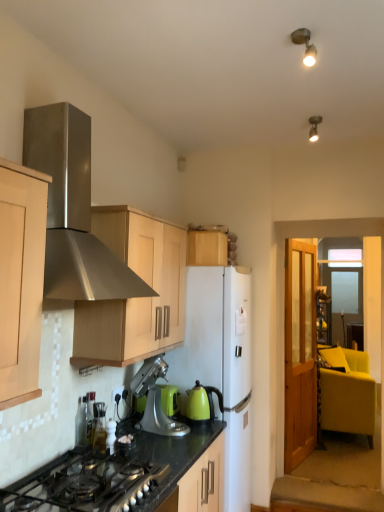
Question: Does metallic spot light at upper right, the 1th light fixture viewed from the left, turn towards black matte gas stove at lower left?

Choices:
 (A) yes
 (B) no

Answer: (B)

Question: Considering the relative sizes of metallic spot light at upper right, the 2th light fixture positioned from the right, and black matte gas stove at lower left in the image provided, is metallic spot light at upper right, the 2th light fixture positioned from the right, wider than black matte gas stove at lower left?

Choices:
 (A) no
 (B) yes

Answer: (A)

Question: Is metallic spot light at upper right, which is the first light fixture in front-to-back order, positioned with its back to black matte gas stove at lower left?

Choices:
 (A) yes
 (B) no

Answer: (B)

Question: From the image's perspective, does metallic spot light at upper right, the 1th light fixture viewed from the left, appear higher than black matte gas stove at lower left?

Choices:
 (A) no
 (B) yes

Answer: (B)

Question: Is metallic spot light at upper right, the 2th light fixture positioned from the right, further to camera compared to black matte gas stove at lower left?

Choices:
 (A) yes
 (B) no

Answer: (A)

Question: Considering their positions, is metallic spot light at upper right, which is the first light fixture in front-to-back order, located in front of or behind green matte kettle at center, the 1th kitchen appliance in the right-to-left sequence?

Choices:
 (A) behind
 (B) front

Answer: (B)

Question: Is metallic spot light at upper right, which is the first light fixture in front-to-back order, bigger or smaller than green matte kettle at center, the 1th kitchen appliance in the right-to-left sequence?

Choices:
 (A) big
 (B) small

Answer: (B)

Question: Is point (299, 36) positioned closer to the camera than point (205, 406)?

Choices:
 (A) farther
 (B) closer

Answer: (B)

Question: From the image's perspective, is metallic spot light at upper right, which is the first light fixture in front-to-back order, located above or below green matte kettle at center, the 1th kitchen appliance in the right-to-left sequence?

Choices:
 (A) below
 (B) above

Answer: (B)

Question: Would you say white matte refrigerator at center is to the left or to the right of green matte kettle at center, the 1th kitchen appliance in the right-to-left sequence, in the picture?

Choices:
 (A) right
 (B) left

Answer: (A)

Question: In terms of width, does white matte refrigerator at center look wider or thinner when compared to green matte kettle at center, the 1th kitchen appliance in the right-to-left sequence?

Choices:
 (A) thin
 (B) wide

Answer: (B)

Question: Does point (190, 359) appear closer or farther from the camera than point (192, 415)?

Choices:
 (A) farther
 (B) closer

Answer: (A)

Question: From the image's perspective, is white matte refrigerator at center positioned above or below green matte kettle at center, the 2th kitchen appliance positioned from the left?

Choices:
 (A) above
 (B) below

Answer: (B)

Question: Which is correct: black granite countertop at lower center is inside silver metallic stand mixer at center, marked as the 1th kitchen appliance in a left-to-right arrangement, or outside of it?

Choices:
 (A) outside
 (B) inside

Answer: (A)

Question: From the image's perspective, is black granite countertop at lower center located above or below silver metallic stand mixer at center, the second kitchen appliance in the right-to-left sequence?

Choices:
 (A) above
 (B) below

Answer: (B)